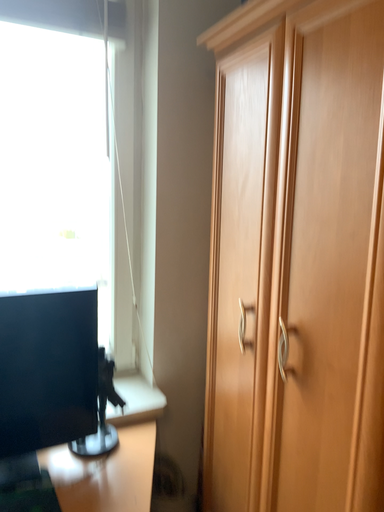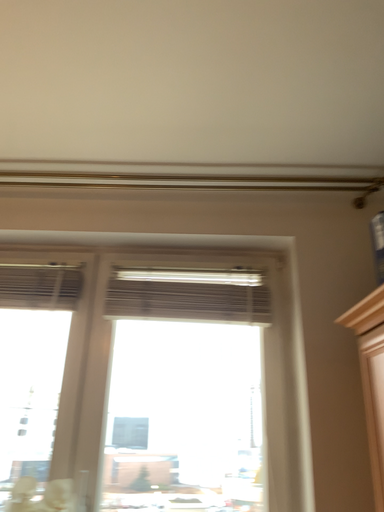
Question: How did the camera likely rotate when shooting the video?

Choices:
 (A) rotated left
 (B) rotated right

Answer: (A)